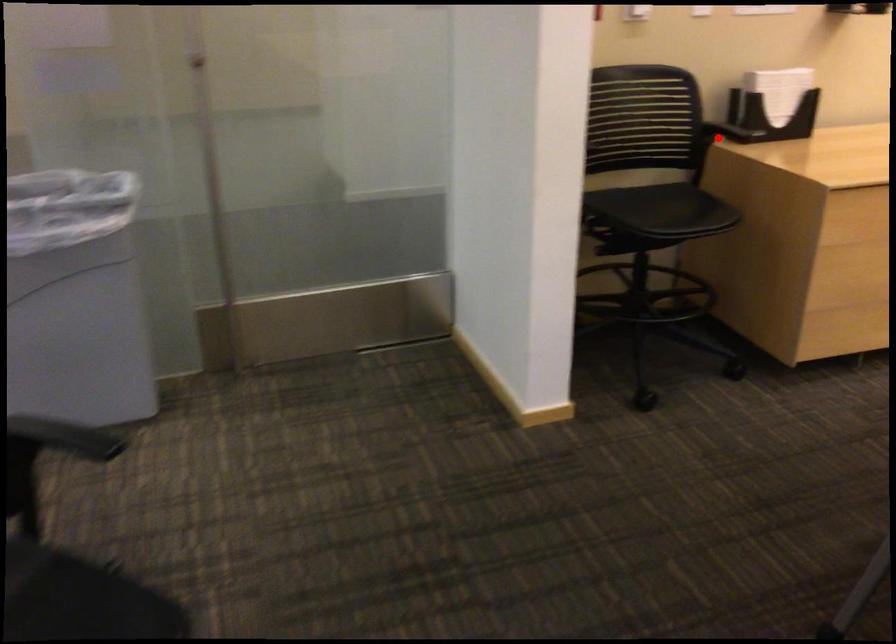
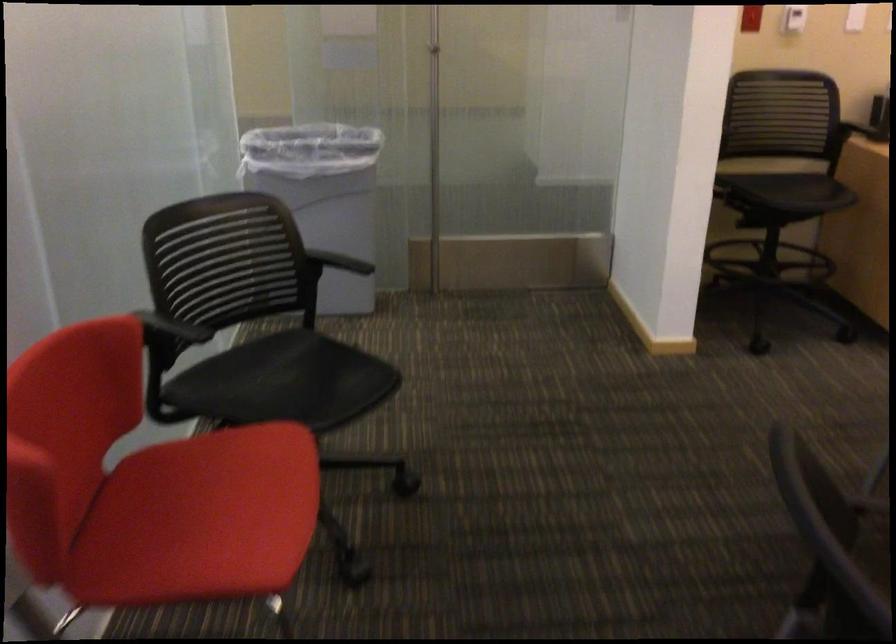
Question: I am providing you with two images of the same scene from different viewpoints. A red point is shown in image1. For the corresponding object point in image2, is it positioned nearer or farther from the camera?

Choices:
 (A) Nearer
 (B) Farther

Answer: (B)